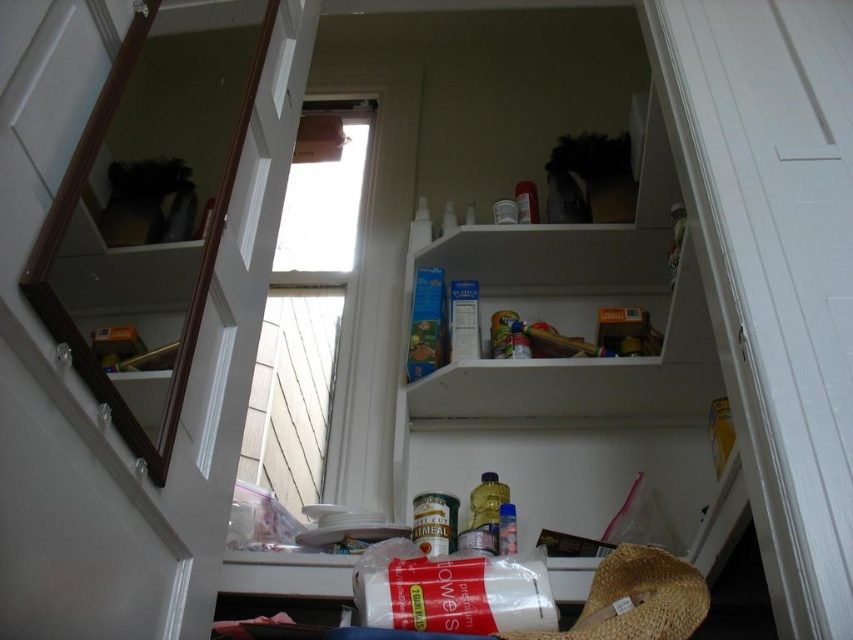
In the scene shown: Does white matte shelf at upper center have a smaller size compared to brown woven straw hat at lower right?

No, white matte shelf at upper center is not smaller than brown woven straw hat at lower right.

The image size is (853, 640). What do you see at coordinates (573, 326) in the screenshot?
I see `white matte shelf at upper center` at bounding box center [573, 326].

Which is behind, point (711, 342) or point (592, 636)?

Point (711, 342)

You are a GUI agent. You are given a task and a screenshot of the screen. Output one action in this format:
    pyautogui.click(x=<x>, y=<y>)
    Task: Click on the white matte shelf at upper center
    
    Given the screenshot: What is the action you would take?
    pyautogui.click(x=573, y=326)